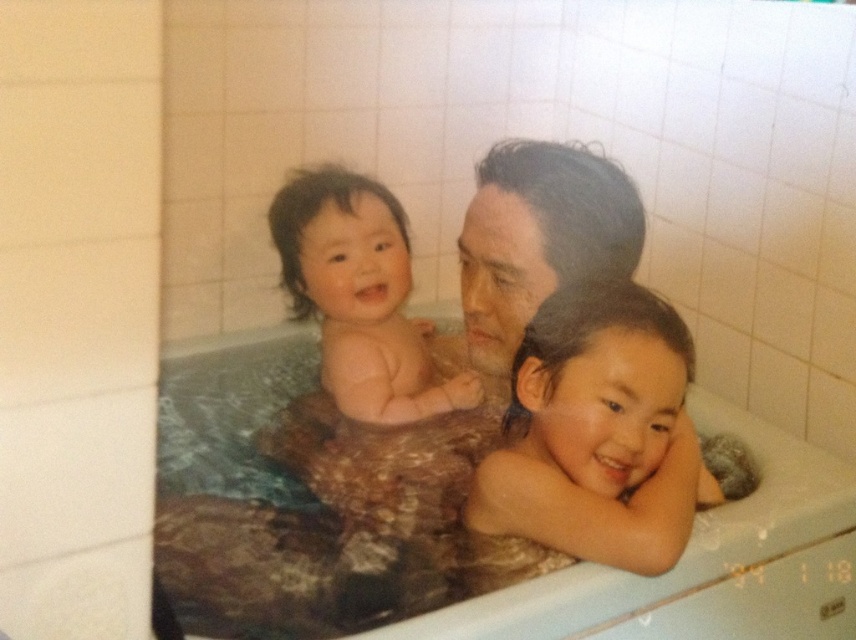
Which is in front, point (642, 406) or point (401, 285)?

Point (642, 406) is more forward.

Is point (679, 483) positioned before point (325, 230)?

Yes, it is in front of point (325, 230).

Who is more forward, (547, 353) or (351, 326)?

Positioned in front is point (547, 353).

Where is `smooth skin child at center`? smooth skin child at center is located at coordinates (598, 433).

Is smooth skin child at center to the right of brown textured fabric at center from the viewer's perspective?

Correct, you'll find smooth skin child at center to the right of brown textured fabric at center.

The height and width of the screenshot is (640, 856). What do you see at coordinates (598, 433) in the screenshot?
I see `smooth skin child at center` at bounding box center [598, 433].

Between point (629, 342) and point (663, 634), which one is positioned in front?

Point (629, 342) is more forward.

Find the location of a particular element. Image resolution: width=856 pixels, height=640 pixels. smooth skin child at center is located at coordinates (598, 433).

Between brown textured fabric at center and smooth skin baby at center, which one appears on the left side from the viewer's perspective?

smooth skin baby at center is more to the left.

Which is behind, point (642, 611) or point (399, 360)?

The point (399, 360) is more distant.

Describe the element at coordinates (699, 563) in the screenshot. This screenshot has width=856, height=640. I see `brown textured fabric at center` at that location.

Identify the location of brown textured fabric at center. The image size is (856, 640). (699, 563).